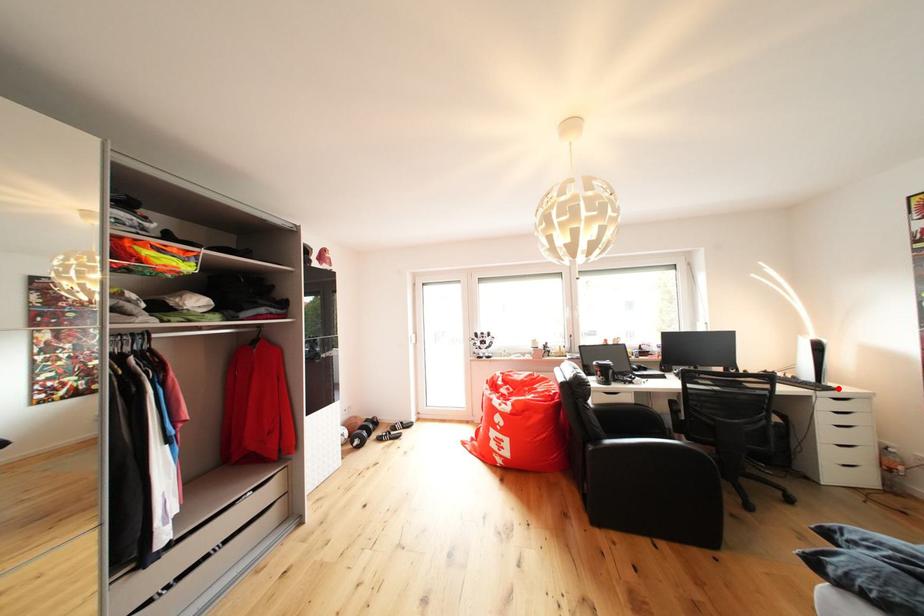
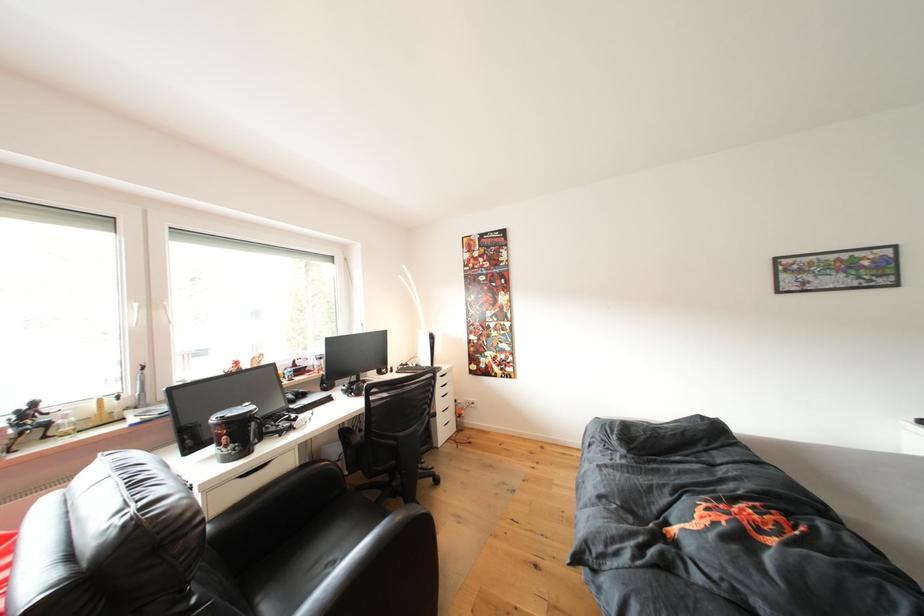
Question: I am providing you with two images of the same scene from different viewpoints. In image1, a red point is highlighted. Considering the same 3D point in image2, which of the following is correct?

Choices:
 (A) It is closer
 (B) It is farther

Answer: (B)